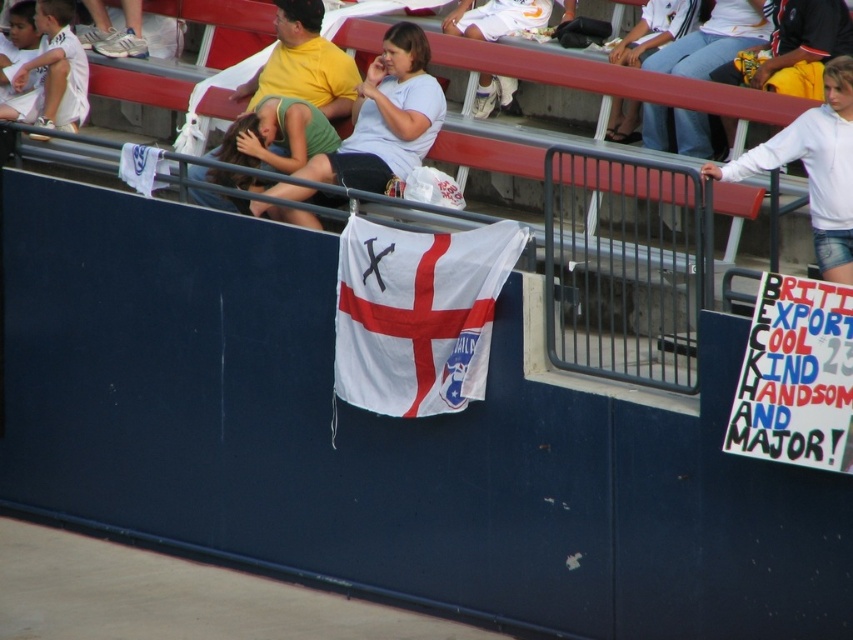
Does white cotton shirt at upper right have a smaller size compared to yellow cotton shirt at upper center?

A: No.

Who is lower down, white cotton shirt at upper right or yellow cotton shirt at upper center?

white cotton shirt at upper right is lower down.

Describe the element at coordinates (814, 168) in the screenshot. Image resolution: width=853 pixels, height=640 pixels. I see `white cotton shirt at upper right` at that location.

Where is `white cotton shirt at upper right`? white cotton shirt at upper right is located at coordinates (814, 168).

Can you confirm if white fabric flag at center is bigger than white jersey at upper left?

Indeed, white fabric flag at center has a larger size compared to white jersey at upper left.

Between point (366, 260) and point (39, 83), which one is positioned behind?

The point (39, 83) is behind.

In order to click on white fabric flag at center in this screenshot , I will do `click(416, 314)`.

Between white cotton shirt at upper right and white cotton shirt at upper center, which one is positioned higher?

Positioned higher is white cotton shirt at upper center.

Does white cotton shirt at upper right have a greater width compared to white cotton shirt at upper center?

In fact, white cotton shirt at upper right might be narrower than white cotton shirt at upper center.

What are the coordinates of `white cotton shirt at upper right` in the screenshot? It's located at (814, 168).